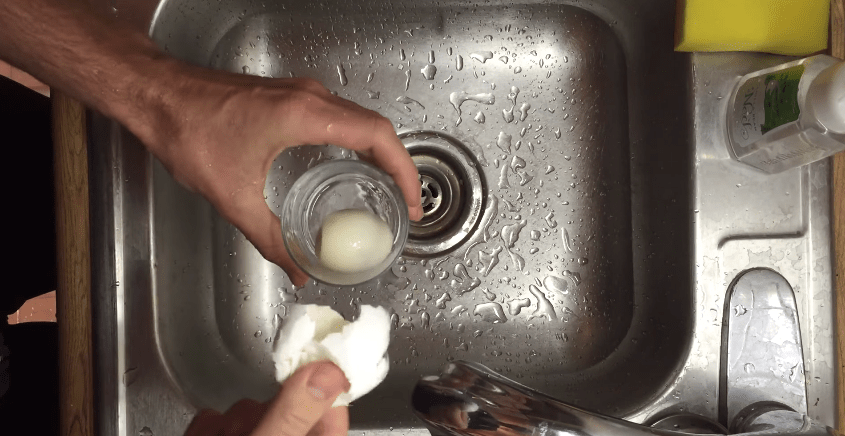
The image size is (845, 436). In order to click on plastic soap bottle in this screenshot , I will do `click(788, 141)`.